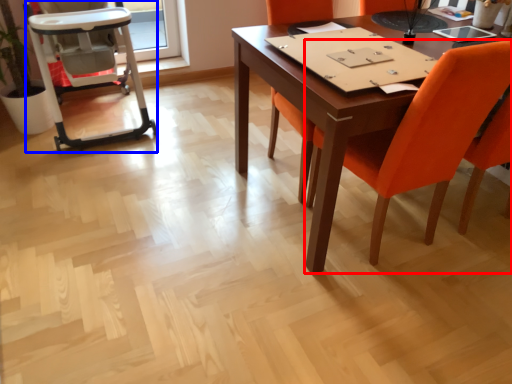
Question: Among these objects, which one is nearest to the camera, chair (highlighted by a red box) or armchair (highlighted by a blue box)?

Choices:
 (A) chair
 (B) armchair

Answer: (A)